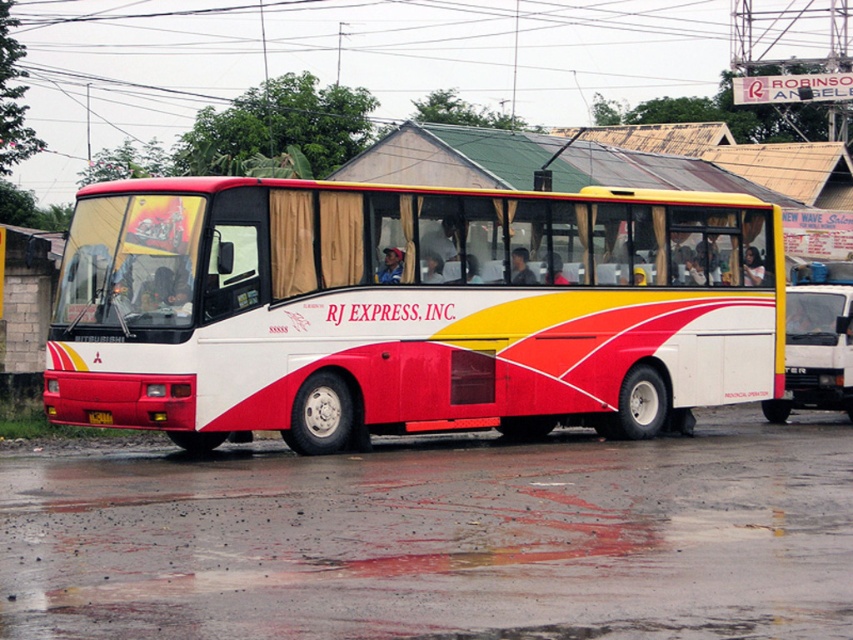
Can you confirm if white glossy tour bus at right is shorter than yellow matte license plate at center?

No, white glossy tour bus at right is not shorter than yellow matte license plate at center.

Who is more forward, (846, 346) or (106, 422)?

Positioned in front is point (106, 422).

Measure the distance between point (808, 300) and camera.

Point (808, 300) is 27.33 meters from camera.

What are the coordinates of `white glossy tour bus at right` in the screenshot? It's located at (816, 349).

Who is positioned more to the left, white matte bus at center or white glossy tour bus at right?

From the viewer's perspective, white matte bus at center appears more on the left side.

Between white matte bus at center and white glossy tour bus at right, which one has less height?

Standing shorter between the two is white glossy tour bus at right.

Identify the location of white matte bus at center. (410, 308).

Is point (281, 376) positioned in front of point (106, 416)?

No, (281, 376) is further to viewer.

Is point (489, 321) farther from camera compared to point (88, 412)?

Yes, point (489, 321) is farther from viewer.

Find the location of `white matte bus at center`. white matte bus at center is located at coordinates (410, 308).